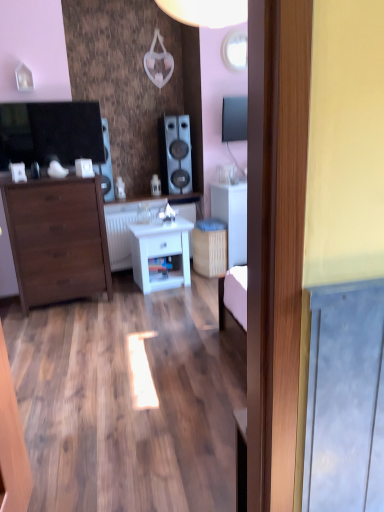
What is the approximate height of white glossy counter top at center, which is the 2th counter top in top-to-bottom order?

28.55 inches.

What do you see at coordinates (157, 200) in the screenshot? I see `white glossy counter top at center, which is the 1th counter top from top to bottom` at bounding box center [157, 200].

Describe the element at coordinates (232, 218) in the screenshot. The height and width of the screenshot is (512, 384). I see `white matte cabinet at center` at that location.

Describe the element at coordinates (106, 166) in the screenshot. I see `matte black speaker at left, which appears as the first speaker when viewed from the left` at that location.

Find the location of a particular element. The image size is (384, 512). white glossy nightstand at center is located at coordinates (160, 253).

Is matte brown chest of drawers at left facing towards white glossy counter top at center, which is counted as the 1th counter top, starting from the bottom?

No, matte brown chest of drawers at left is not oriented towards white glossy counter top at center, which is counted as the 1th counter top, starting from the bottom.

Image resolution: width=384 pixels, height=512 pixels. There is a matte brown chest of drawers at left. What are the coordinates of `the 1st counter top above it (from the image's perspective)` in the screenshot? It's located at (124, 228).

Considering the positions of objects matte brown chest of drawers at left and white glossy counter top at center, which is the 2th counter top in top-to-bottom order, in the image provided, who is more to the right, matte brown chest of drawers at left or white glossy counter top at center, which is the 2th counter top in top-to-bottom order,?

From the viewer's perspective, white glossy counter top at center, which is the 2th counter top in top-to-bottom order, appears more on the right side.

Could you measure the distance between matte brown chest of drawers at left and white glossy counter top at center, which is the 2th counter top in top-to-bottom order?

They are 58.79 centimeters apart.

Measure the distance between white matte cabinet at center and satin black speaker at center, the 2th speaker when ordered from left to right.

The distance of white matte cabinet at center from satin black speaker at center, the 2th speaker when ordered from left to right, is 57.99 centimeters.

Is white matte cabinet at center turned away from satin black speaker at center, arranged as the 1th speaker when viewed from the right?

No, white matte cabinet at center's orientation is not away from satin black speaker at center, arranged as the 1th speaker when viewed from the right.

Are white matte cabinet at center and satin black speaker at center, the 2th speaker when ordered from left to right, making contact?

There is a gap between white matte cabinet at center and satin black speaker at center, the 2th speaker when ordered from left to right.

From a real-world perspective, is white matte cabinet at center beneath satin black speaker at center, arranged as the 1th speaker when viewed from the right?

Yes, from a real-world perspective, white matte cabinet at center is under satin black speaker at center, arranged as the 1th speaker when viewed from the right.

Which is in front, point (110, 179) or point (175, 174)?

Point (110, 179)

From a real-world perspective, between matte black speaker at left, positioned as the second speaker in right-to-left order, and satin black speaker at center, arranged as the 1th speaker when viewed from the right, who is vertically higher?

satin black speaker at center, arranged as the 1th speaker when viewed from the right.

Is satin black speaker at center, the 2th speaker when ordered from left to right, at the back of matte black speaker at left, positioned as the second speaker in right-to-left order?

No, matte black speaker at left, positioned as the second speaker in right-to-left order, is not facing away from satin black speaker at center, the 2th speaker when ordered from left to right.

Considering the relative positions of white matte cabinet at center and matte black speaker at left, which appears as the first speaker when viewed from the left, in the image provided, is white matte cabinet at center to the left of matte black speaker at left, which appears as the first speaker when viewed from the left, from the viewer's perspective?

In fact, white matte cabinet at center is to the right of matte black speaker at left, which appears as the first speaker when viewed from the left.

Is white matte cabinet at center looking in the opposite direction of matte black speaker at left, which appears as the first speaker when viewed from the left?

No, white matte cabinet at center's orientation is not away from matte black speaker at left, which appears as the first speaker when viewed from the left.

From a real-world perspective, between white matte cabinet at center and matte black speaker at left, positioned as the second speaker in right-to-left order, who is vertically lower?

From a 3D spatial view, white matte cabinet at center is below.

From the image's perspective, is white matte cabinet at center positioned above or below matte black speaker at left, positioned as the second speaker in right-to-left order?

white matte cabinet at center is situated lower than matte black speaker at left, positioned as the second speaker in right-to-left order, in the image.

Considering the relative sizes of white glossy counter top at center, which ranks as the second counter top in bottom-to-top order, and satin black speaker at center, arranged as the 1th speaker when viewed from the right, in the image provided, is white glossy counter top at center, which ranks as the second counter top in bottom-to-top order, smaller than satin black speaker at center, arranged as the 1th speaker when viewed from the right,?

Correct, white glossy counter top at center, which ranks as the second counter top in bottom-to-top order, occupies less space than satin black speaker at center, arranged as the 1th speaker when viewed from the right.

Which object is wider, white glossy counter top at center, which is the 1th counter top from top to bottom, or satin black speaker at center, arranged as the 1th speaker when viewed from the right?

With larger width is white glossy counter top at center, which is the 1th counter top from top to bottom.

From the image's perspective, is white glossy counter top at center, which ranks as the second counter top in bottom-to-top order, located above satin black speaker at center, the 2th speaker when ordered from left to right?

No, from the image's perspective, white glossy counter top at center, which ranks as the second counter top in bottom-to-top order, is not over satin black speaker at center, the 2th speaker when ordered from left to right.

Is white glossy counter top at center, which is the 1th counter top from top to bottom, at the left side of satin black speaker at center, arranged as the 1th speaker when viewed from the right?

Indeed, white glossy counter top at center, which is the 1th counter top from top to bottom, is positioned on the left side of satin black speaker at center, arranged as the 1th speaker when viewed from the right.

From the image's perspective, is white glossy counter top at center, which is the 2th counter top in top-to-bottom order, over satin black speaker at center, the 2th speaker when ordered from left to right?

Actually, white glossy counter top at center, which is the 2th counter top in top-to-bottom order, appears below satin black speaker at center, the 2th speaker when ordered from left to right, in the image.

Which is more to the right, white glossy counter top at center, which is counted as the 1th counter top, starting from the bottom, or satin black speaker at center, arranged as the 1th speaker when viewed from the right?

Positioned to the right is satin black speaker at center, arranged as the 1th speaker when viewed from the right.

Is white glossy counter top at center, which is counted as the 1th counter top, starting from the bottom, next to satin black speaker at center, the 2th speaker when ordered from left to right, and touching it?

white glossy counter top at center, which is counted as the 1th counter top, starting from the bottom, and satin black speaker at center, the 2th speaker when ordered from left to right, are clearly separated.

Considering the relative sizes of white glossy counter top at center, which is the 2th counter top in top-to-bottom order, and satin black speaker at center, the 2th speaker when ordered from left to right, in the image provided, is white glossy counter top at center, which is the 2th counter top in top-to-bottom order, smaller than satin black speaker at center, the 2th speaker when ordered from left to right,?

Actually, white glossy counter top at center, which is the 2th counter top in top-to-bottom order, might be larger than satin black speaker at center, the 2th speaker when ordered from left to right.

Between matte brown chest of drawers at left and white matte cabinet at center, which one has smaller width?

matte brown chest of drawers at left.

From a real-world perspective, is matte brown chest of drawers at left beneath white matte cabinet at center?

No, from a real-world perspective, matte brown chest of drawers at left is not beneath white matte cabinet at center.

Is point (49, 197) less distant than point (243, 238)?

That is True.

This screenshot has height=512, width=384. I want to click on the chest of drawers that is in front of the white glossy counter top at center, which is the 2th counter top in top-to-bottom order, so click(57, 239).

I want to click on speaker that is the 2nd one above the white matte cabinet at center (from a real-world perspective), so click(x=175, y=154).

Considering their positions, is matte brown chest of drawers at left positioned closer to white glossy nightstand at center than white glossy counter top at center, which is counted as the 1th counter top, starting from the bottom?

white glossy counter top at center, which is counted as the 1th counter top, starting from the bottom, is closer to white glossy nightstand at center.

Looking at the image, which one is located further to matte brown chest of drawers at left, white matte cabinet at center or white glossy counter top at center, which is the 2th counter top in top-to-bottom order?

white matte cabinet at center lies further to matte brown chest of drawers at left than the other object.

Estimate the real-world distances between objects in this image. Which object is closer to matte brown chest of drawers at left, matte black speaker at left, which appears as the first speaker when viewed from the left, or white matte cabinet at center?

matte black speaker at left, which appears as the first speaker when viewed from the left, is closer to matte brown chest of drawers at left.

When comparing their distances from white glossy counter top at center, which ranks as the second counter top in bottom-to-top order, does white glossy nightstand at center or satin black speaker at center, arranged as the 1th speaker when viewed from the right, seem further?

white glossy nightstand at center is further to white glossy counter top at center, which ranks as the second counter top in bottom-to-top order.

From the image, which object appears to be farther from white matte cabinet at center, matte brown chest of drawers at left or satin black speaker at center, arranged as the 1th speaker when viewed from the right?

Among the two, matte brown chest of drawers at left is located further to white matte cabinet at center.

Based on their spatial positions, is white matte cabinet at center or white glossy counter top at center, which is the 1th counter top from top to bottom, further from satin black speaker at center, arranged as the 1th speaker when viewed from the right?

white matte cabinet at center is positioned further to the anchor satin black speaker at center, arranged as the 1th speaker when viewed from the right.

Estimate the real-world distances between objects in this image. Which object is closer to white matte cabinet at center, white glossy nightstand at center or matte black speaker at left, which appears as the first speaker when viewed from the left?

white glossy nightstand at center lies closer to white matte cabinet at center than the other object.

Estimate the real-world distances between objects in this image. Which object is closer to matte black speaker at left, which appears as the first speaker when viewed from the left, white glossy counter top at center, which is the 2th counter top in top-to-bottom order, or white matte cabinet at center?

white glossy counter top at center, which is the 2th counter top in top-to-bottom order, is positioned closer to the anchor matte black speaker at left, which appears as the first speaker when viewed from the left.

The height and width of the screenshot is (512, 384). Find the location of `speaker between matte brown chest of drawers at left and white glossy counter top at center, which is counted as the 1th counter top, starting from the bottom, along the z-axis`. speaker between matte brown chest of drawers at left and white glossy counter top at center, which is counted as the 1th counter top, starting from the bottom, along the z-axis is located at coordinates (106, 166).

This screenshot has width=384, height=512. What are the coordinates of `speaker between satin black speaker at center, arranged as the 1th speaker when viewed from the right, and white glossy counter top at center, which is counted as the 1th counter top, starting from the bottom, in the up-down direction` in the screenshot? It's located at (106, 166).

This screenshot has height=512, width=384. I want to click on counter top between matte black speaker at left, which appears as the first speaker when viewed from the left, and white glossy counter top at center, which is counted as the 1th counter top, starting from the bottom, in the up-down direction, so click(157, 200).

Where is `nightstand situated between white glossy counter top at center, which is counted as the 1th counter top, starting from the bottom, and white matte cabinet at center from left to right`? nightstand situated between white glossy counter top at center, which is counted as the 1th counter top, starting from the bottom, and white matte cabinet at center from left to right is located at coordinates pyautogui.click(x=160, y=253).